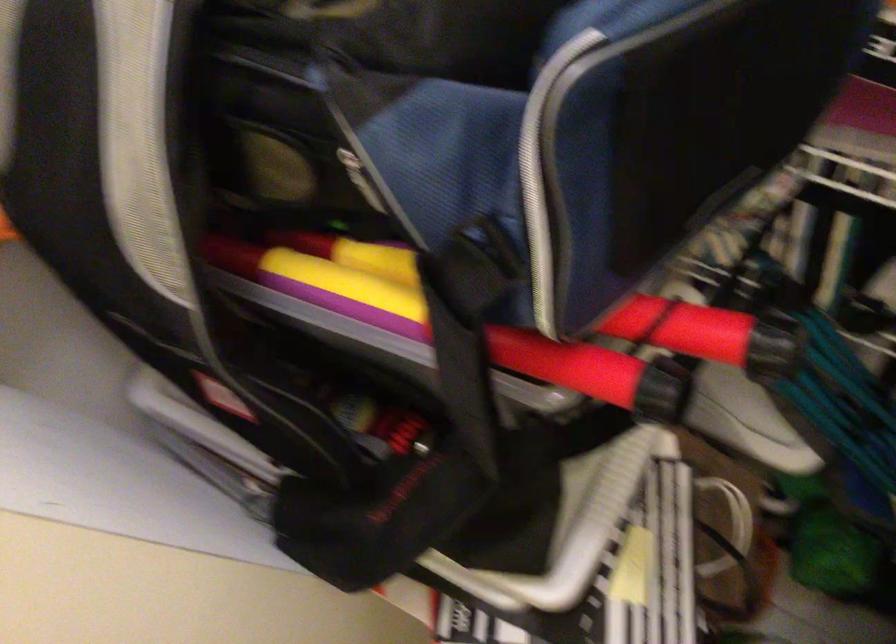
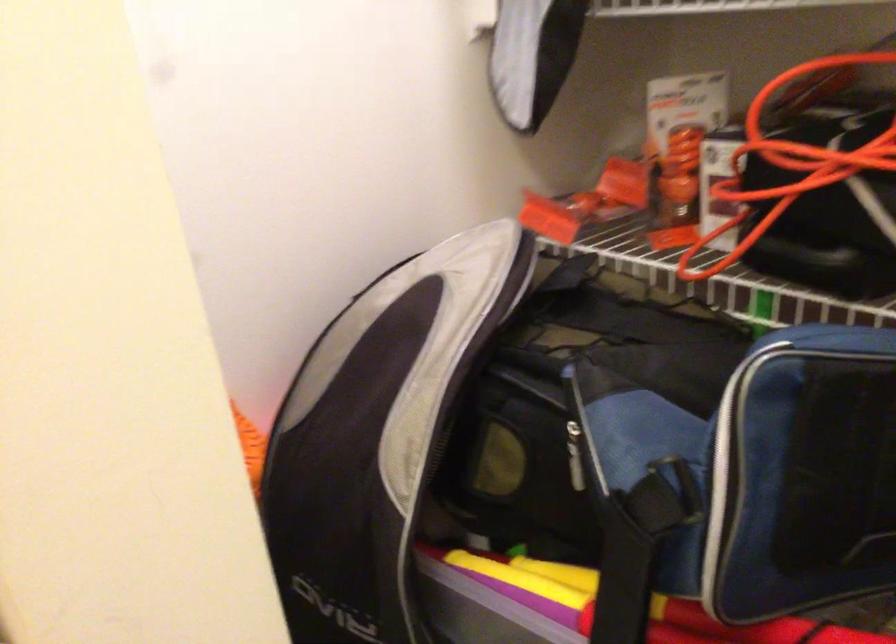
Based on the continuous images, in which direction is the camera rotating?

The rotation direction of the camera is left-up.